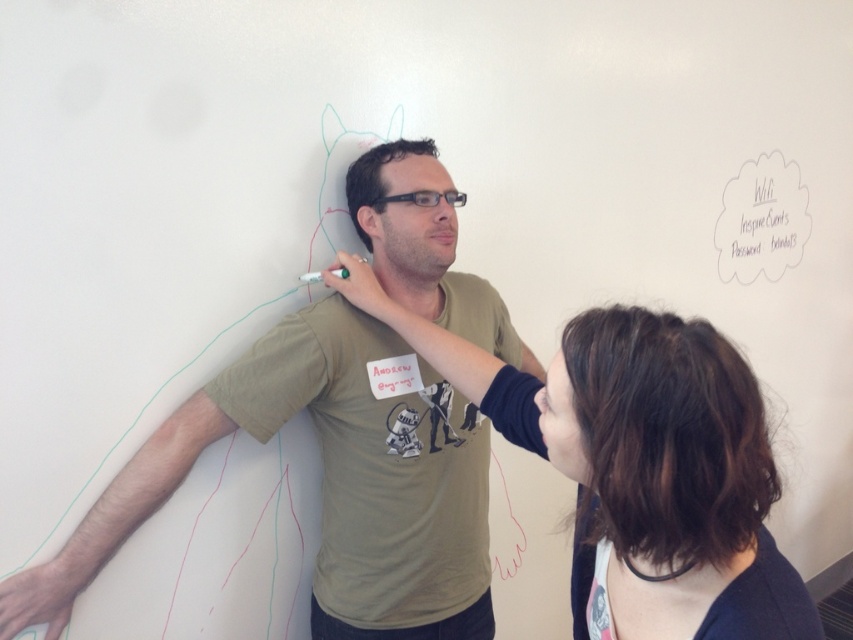
Question: Which object is farther from the camera taking this photo?

Choices:
 (A) matte khaki t-shirt at center
 (B) dark brown hair at upper right

Answer: (A)

Question: Where is matte khaki t-shirt at center located in relation to dark brown hair at upper right in the image?

Choices:
 (A) below
 (B) above

Answer: (A)

Question: Does matte khaki t-shirt at center come in front of dark brown hair at upper right?

Choices:
 (A) no
 (B) yes

Answer: (A)

Question: Which object is farther from the camera taking this photo?

Choices:
 (A) matte khaki t-shirt at center
 (B) dark brown hair at upper right

Answer: (A)

Question: Can you confirm if matte khaki t-shirt at center is positioned to the right of dark brown hair at upper right?

Choices:
 (A) no
 (B) yes

Answer: (A)